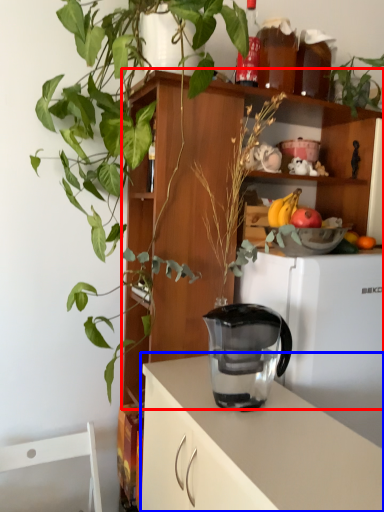
Question: Which object appears closest to the camera in this image, shelf (highlighted by a red box) or cabinetry (highlighted by a blue box)?

Choices:
 (A) shelf
 (B) cabinetry

Answer: (B)